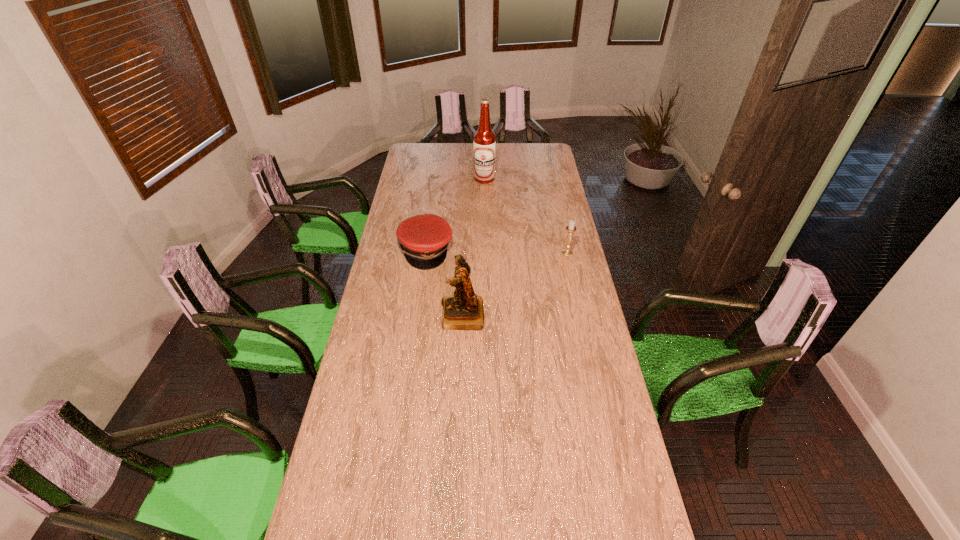
Locate an element on the screen. vacant space that is in between the alcohol and the second shortest object is located at coordinates (526, 216).

The image size is (960, 540). Identify the location of free space between the cap and the alcohol. (455, 215).

At what (x,y) coordinates should I click in order to perform the action: click on free space between the cap and the third shortest object. Please return your answer as a coordinate pair (x, y). Image resolution: width=960 pixels, height=540 pixels. Looking at the image, I should click on (444, 283).

This screenshot has width=960, height=540. Identify the location of empty space that is in between the shortest object and the nearest object. (444, 283).

You are a GUI agent. You are given a task and a screenshot of the screen. Output one action in this format:
    pyautogui.click(x=<x>, y=<y>)
    Task: Click on the vacant point located between the figurine and the shortest object
    The image size is (960, 540).
    Given the screenshot: What is the action you would take?
    pyautogui.click(x=444, y=283)

I want to click on object that stands as the second closest to the shortest object, so click(484, 141).

The width and height of the screenshot is (960, 540). I want to click on object identified as the closest to the second tallest object, so click(424, 238).

Image resolution: width=960 pixels, height=540 pixels. I want to click on vacant point that satisfies the following two spatial constraints: 1. on the back side of the cap; 2. on the right side of the tallest object, so click(436, 179).

Identify the location of free region that satisfies the following two spatial constraints: 1. on the front side of the cap; 2. on the front-facing side of the nearest object. The width and height of the screenshot is (960, 540). (417, 315).

At what (x,y) coordinates should I click in order to perform the action: click on vacant area in the image that satisfies the following two spatial constraints: 1. on the back side of the cap; 2. on the right side of the alcohol. Please return your answer as a coordinate pair (x, y). Image resolution: width=960 pixels, height=540 pixels. Looking at the image, I should click on (436, 179).